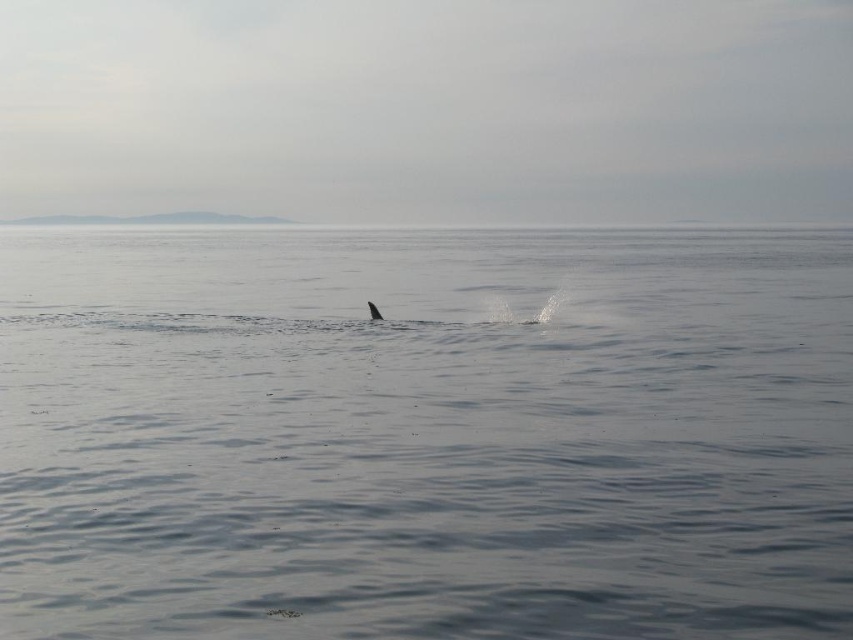
Question: Is clear water at center positioned behind gray matte whale at center?

Choices:
 (A) yes
 (B) no

Answer: (B)

Question: Is clear water at center to the left of gray matte whale at center from the viewer's perspective?

Choices:
 (A) yes
 (B) no

Answer: (A)

Question: Is clear water at center to the left of gray matte whale at center from the viewer's perspective?

Choices:
 (A) yes
 (B) no

Answer: (A)

Question: Which of the following is the closest to the observer?

Choices:
 (A) (117, 227)
 (B) (372, 308)

Answer: (B)